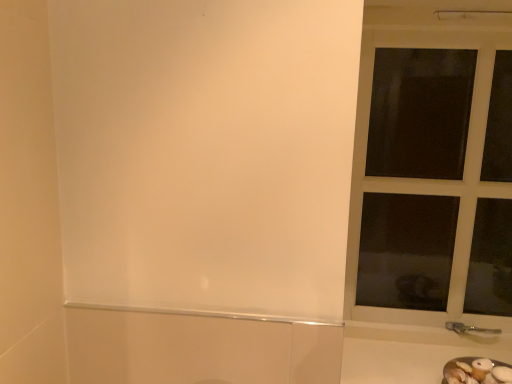
Measure the distance between point (470, 42) and camera.

Point (470, 42) is 1.27 meters away from camera.

Locate an element on the screen. This screenshot has height=384, width=512. white plastic window at right is located at coordinates pyautogui.click(x=426, y=180).

Describe the element at coordinates (426, 180) in the screenshot. I see `white plastic window at right` at that location.

Find the location of a particular element. The image size is (512, 384). white plastic window at right is located at coordinates (426, 180).